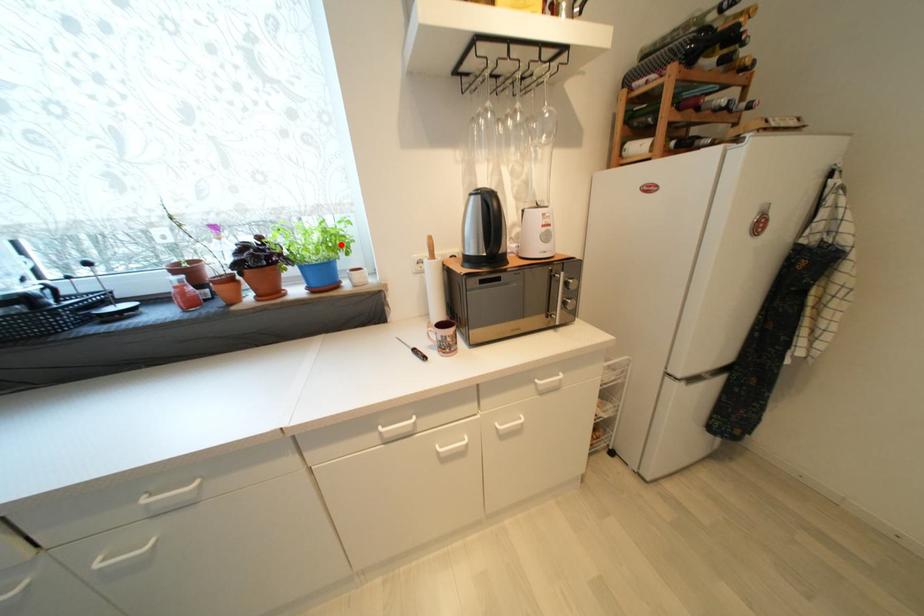
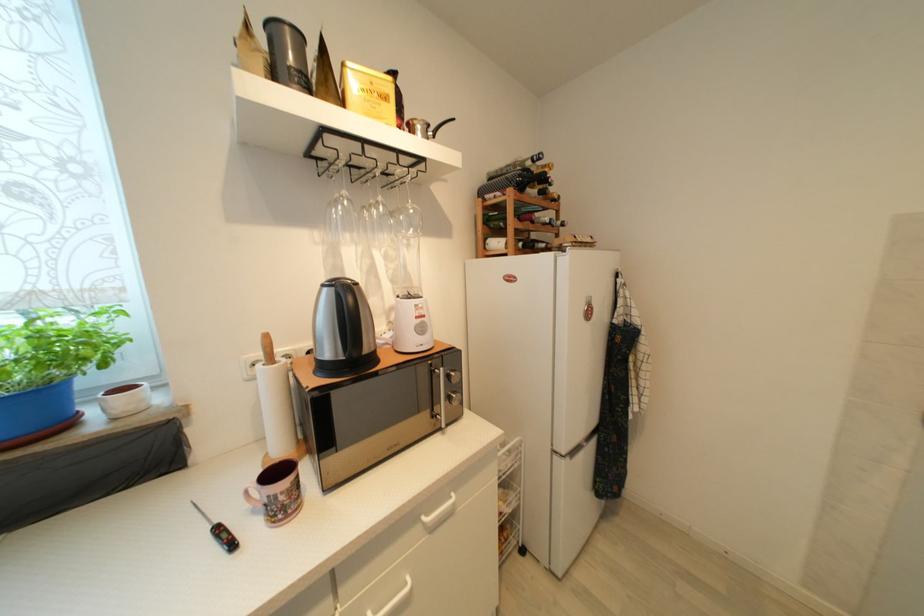
In the second image, find the point that corresponds to the highlighted location in the first image.

(77, 353)